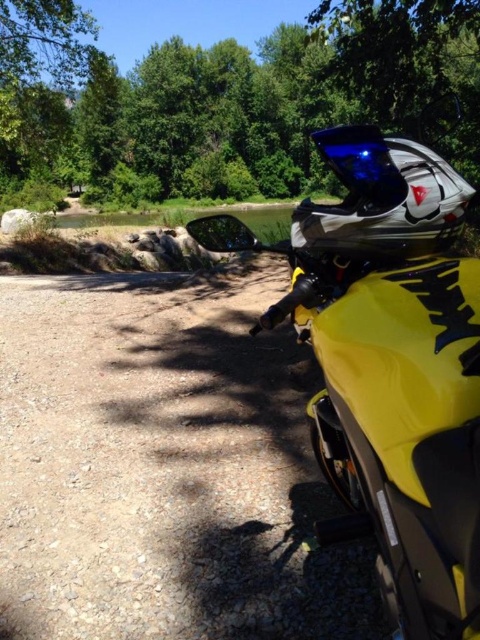
You are a drone operator planning to fly a drone over the yellow matte dirt track at center and the green leafy tree at upper center. Which object will the drone need to fly higher over?

The drone will need to fly higher over the green leafy tree at upper center because it has a greater height than the yellow matte dirt track at center.